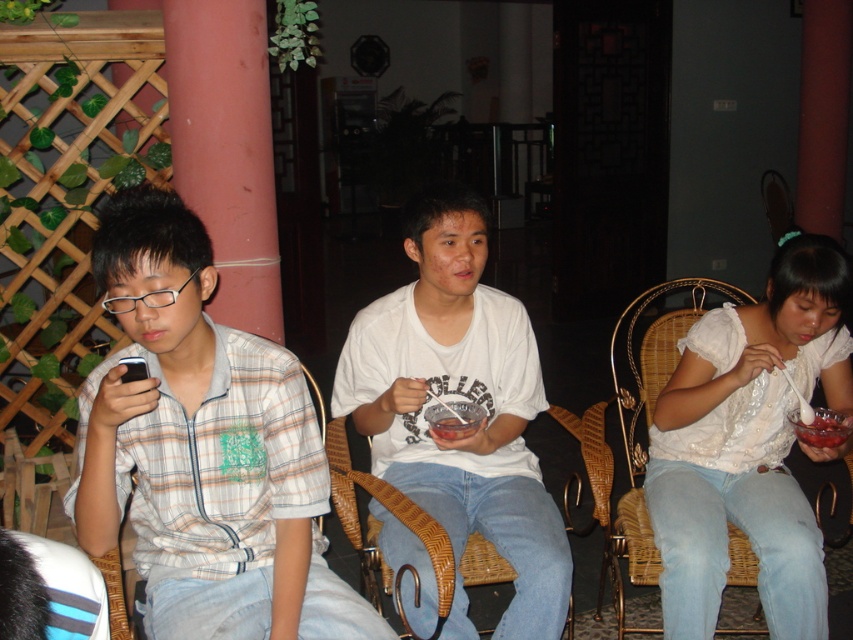
You are trying to find the plaid shirt at left and the woven wicker chair at center in the image. Based on their positions, which one is located more to the left?

The plaid shirt at left is more to the left than the woven wicker chair at center.